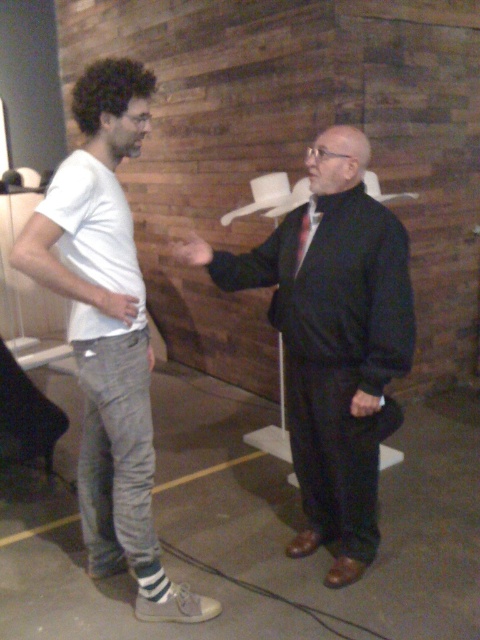
How much distance is there between white matte hand at center and smooth black hand at center?

The distance of white matte hand at center from smooth black hand at center is 30.90 inches.

Who is more distant from viewer, (127,312) or (359,410)?

Point (359,410)

The height and width of the screenshot is (640, 480). Find the location of `white matte hand at center`. white matte hand at center is located at coordinates (116, 305).

Between point (106, 506) and point (299, 266), which one is positioned in front?

Point (299, 266) is in front.

Is white cotton t-shirt at left wider than dark red silk tie at center?

Indeed, white cotton t-shirt at left has a greater width compared to dark red silk tie at center.

Where is `white cotton t-shirt at left`? white cotton t-shirt at left is located at coordinates (108, 333).

In the scene shown: Is matte black jacket at center to the left of matte black hand at center from the viewer's perspective?

Incorrect, matte black jacket at center is not on the left side of matte black hand at center.

Describe the element at coordinates (335, 342) in the screenshot. The height and width of the screenshot is (640, 480). I see `matte black jacket at center` at that location.

Who is more forward, (310, 256) or (175, 246)?

Point (310, 256) is in front.

Image resolution: width=480 pixels, height=640 pixels. I want to click on matte black jacket at center, so click(x=335, y=342).